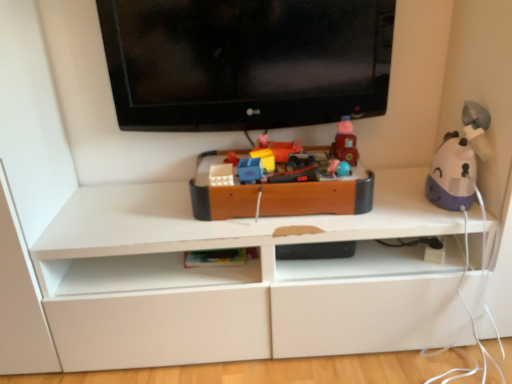
Question: In terms of height, does matte plastic toy car at center, the 3th toy positioned from the left, look taller or shorter compared to wooden toy train at center, which appears as the 3th toy when viewed from the right?

Choices:
 (A) short
 (B) tall

Answer: (A)

Question: Based on their sizes in the image, would you say matte plastic toy car at center, the 3th toy positioned from the left, is bigger or smaller than wooden toy train at center, which appears as the 3th toy when viewed from the right?

Choices:
 (A) small
 (B) big

Answer: (A)

Question: Which object is positioned closest to the matte plastic toy at center, the second toy positioned from the right?

Choices:
 (A) wooden toy train at center, which appears as the 3th toy when viewed from the right
 (B) matte plastic toy at center, which is counted as the 1th toy, starting from the left
 (C) purple matte humidifier at right, the 6th toy from the left
 (D) black glossy tv at upper center
 (E) matte plastic toy car at center, arranged as the 4th toy when viewed from the right

Answer: (E)

Question: Which is farther from the matte plastic toy car at center, the 3th toy positioned from the left?

Choices:
 (A) purple matte humidifier at right, the 6th toy from the left
 (B) blue plastic toy at center, positioned as the fifth toy in right-to-left order
 (C) matte plastic toy at center, the second toy positioned from the right
 (D) wooden toy train at center, which appears as the 4th toy when viewed from the left
 (E) black glossy tv at upper center

Answer: (A)